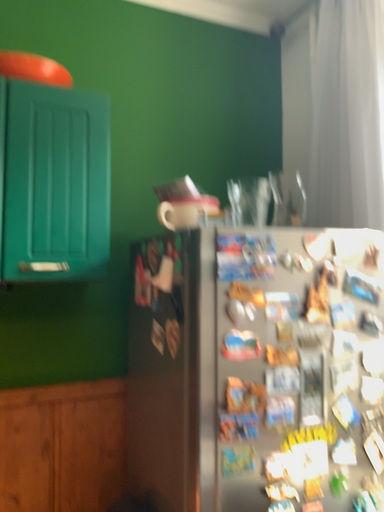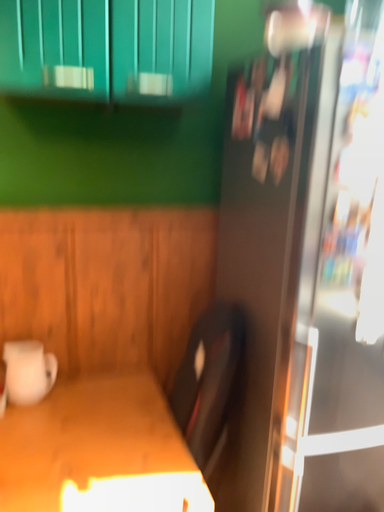
Question: Which way did the camera rotate in the video?

Choices:
 (A) rotated left
 (B) rotated right

Answer: (A)